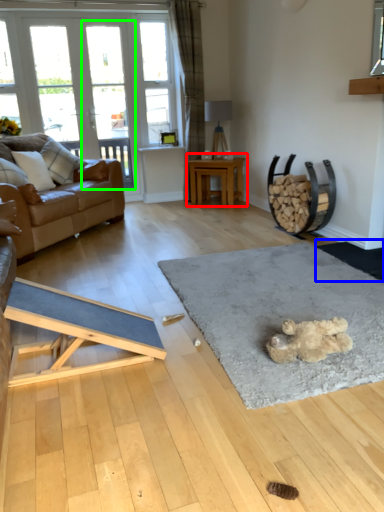
Question: Which is farther away from table (highlighted by a red box)? doormat (highlighted by a blue box) or screen door (highlighted by a green box)?

Choices:
 (A) doormat
 (B) screen door

Answer: (A)